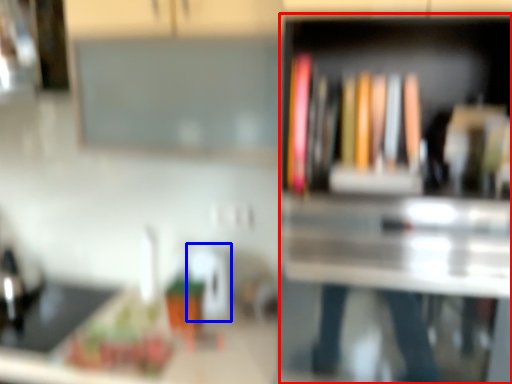
Question: Among these objects, which one is nearest to the camera, bookshelf (highlighted by a red box) or appliance (highlighted by a blue box)?

Choices:
 (A) bookshelf
 (B) appliance

Answer: (A)